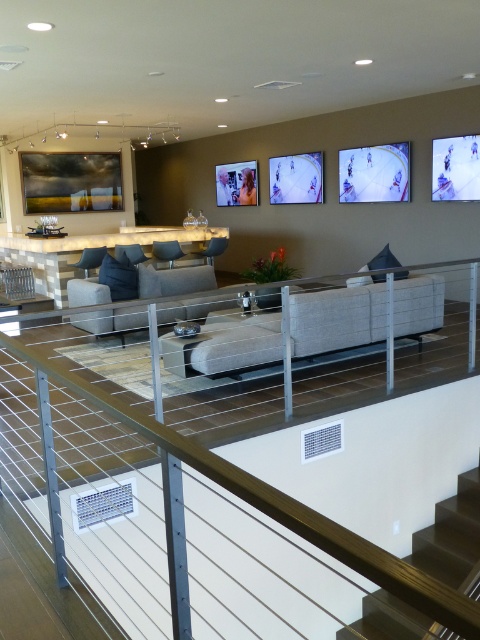
Is point (264, 538) closer to camera compared to point (301, 330)?

Yes.

Between point (70, 413) and point (292, 316), which one is positioned in front?

Point (70, 413)

You are a GUI agent. You are given a task and a screenshot of the screen. Output one action in this format:
    pyautogui.click(x=<x>, y=<y>)
    Task: Click on the white metal rail at lower center
    Image resolution: width=480 pixels, height=640 pixels.
    Given the screenshot: What is the action you would take?
    pyautogui.click(x=184, y=524)

Is point (333, 600) less distant than point (362, 600)?

No, it is not.

Between white metal rail at lower center and dark wood stairs at lower right, which one is positioned higher?

Positioned higher is white metal rail at lower center.

Between point (214, 461) and point (440, 545), which one is positioned in front?

Point (214, 461)

This screenshot has width=480, height=640. In order to click on white metal rail at lower center in this screenshot , I will do `click(184, 524)`.

What do you see at coordinates (336, 317) in the screenshot? I see `neutral fabric couch at center` at bounding box center [336, 317].

Is neutral fabric couch at center to the right of dark wood stairs at lower right from the viewer's perspective?

Incorrect, neutral fabric couch at center is not on the right side of dark wood stairs at lower right.

The image size is (480, 640). I want to click on neutral fabric couch at center, so click(336, 317).

Where is `neutral fabric couch at center`? The image size is (480, 640). neutral fabric couch at center is located at coordinates (336, 317).